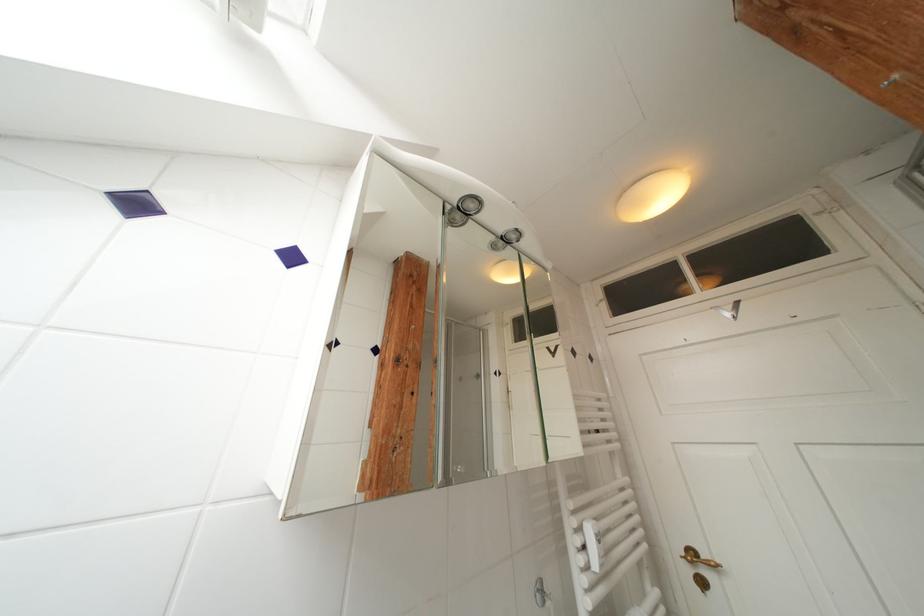
Describe the element at coordinates (728, 310) in the screenshot. I see `the round wall hook` at that location.